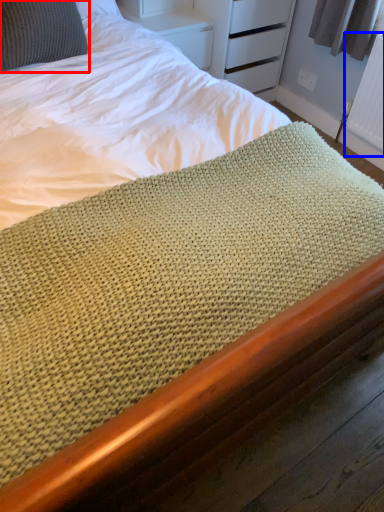
Question: Among these objects, which one is farthest to the camera, pillow (highlighted by a red box) or radiator (highlighted by a blue box)?

Choices:
 (A) pillow
 (B) radiator

Answer: (B)